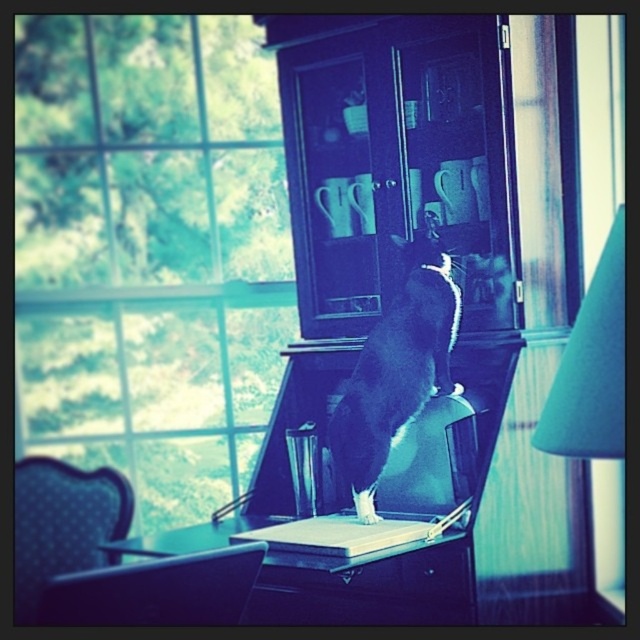
You are sitting in the blue dotted fabric chair at lower left and want to turn on the teal fabric lampshade at right. Can you reach it without moving from your seat?

The teal fabric lampshade at right is in front of the blue dotted fabric chair at lower left, so you can likely reach it without moving from your seat since it is positioned within arm

You are a cat owner who wants to place a small cat bed between the teal fabric lampshade at right and the blue dotted fabric chair at lower left. Based on their heights, which object should the cat bed be placed closer to so it doesn

The teal fabric lampshade at right is not as tall as the blue dotted fabric chair at lower left, so the cat bed should be placed closer to the teal fabric lampshade at right to ensure it is at a lower height for easy access.

You are sitting in the matte black chair at lower left and want to pet the black fur cat at center. Can you reach it without moving from your seat?

The black fur cat at center is above the matte black chair at lower left, so you can reach it by extending your arm upwards from the matte black chair at lower left.